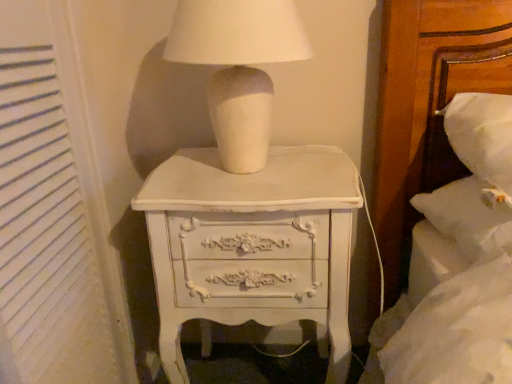
Question: Should I look upward or downward to see white painted wood chest of drawers at center?

Choices:
 (A) down
 (B) up

Answer: (A)

Question: From a real-world perspective, is white matte ceramic lamp at upper center positioned under white painted wood chest of drawers at center based on gravity?

Choices:
 (A) no
 (B) yes

Answer: (A)

Question: Is white matte ceramic lamp at upper center looking in the opposite direction of white painted wood chest of drawers at center?

Choices:
 (A) yes
 (B) no

Answer: (B)

Question: Can you confirm if white matte ceramic lamp at upper center is taller than white painted wood chest of drawers at center?

Choices:
 (A) no
 (B) yes

Answer: (A)

Question: Would you consider white matte ceramic lamp at upper center to be distant from white painted wood chest of drawers at center?

Choices:
 (A) no
 (B) yes

Answer: (A)

Question: Can you confirm if white matte ceramic lamp at upper center is wider than white painted wood chest of drawers at center?

Choices:
 (A) yes
 (B) no

Answer: (B)

Question: Is white matte ceramic lamp at upper center with white painted wood chest of drawers at center?

Choices:
 (A) no
 (B) yes

Answer: (A)

Question: Is white painted wood chest of drawers at center positioned in front of white matte ceramic lamp at upper center?

Choices:
 (A) no
 (B) yes

Answer: (A)

Question: From a real-world perspective, is white painted wood chest of drawers at center physically below white matte ceramic lamp at upper center?

Choices:
 (A) yes
 (B) no

Answer: (A)

Question: Is the surface of white painted wood chest of drawers at center in direct contact with white matte ceramic lamp at upper center?

Choices:
 (A) yes
 (B) no

Answer: (B)

Question: Considering the relative sizes of white painted wood chest of drawers at center and white matte ceramic lamp at upper center in the image provided, is white painted wood chest of drawers at center shorter than white matte ceramic lamp at upper center?

Choices:
 (A) no
 (B) yes

Answer: (A)

Question: Can you confirm if white painted wood chest of drawers at center is wider than white matte ceramic lamp at upper center?

Choices:
 (A) yes
 (B) no

Answer: (A)

Question: From a real-world perspective, is white painted wood chest of drawers at center on top of white matte ceramic lamp at upper center?

Choices:
 (A) yes
 (B) no

Answer: (B)

Question: From the image's perspective, would you say white matte ceramic lamp at upper center is positioned over white textured curtain at left?

Choices:
 (A) no
 (B) yes

Answer: (B)